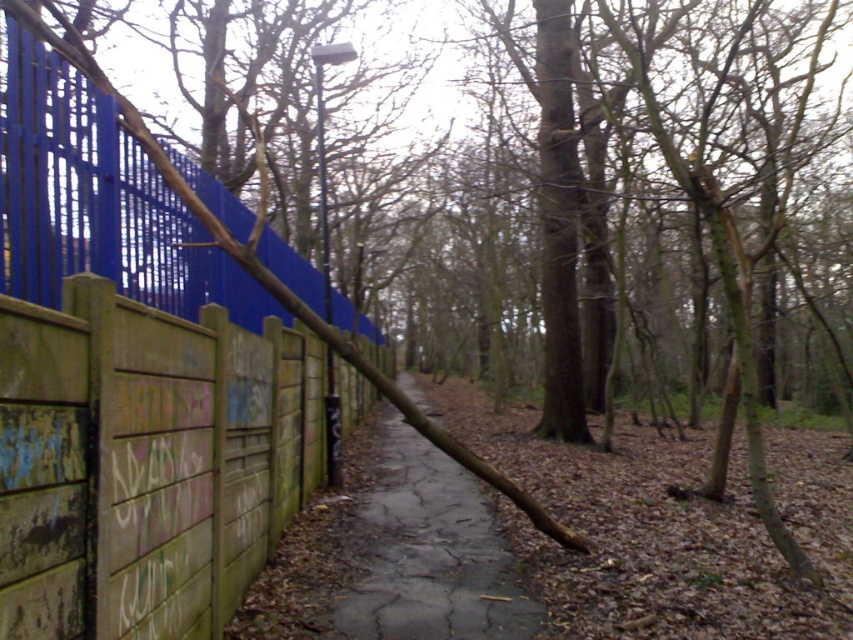
You are a delivery robot with a 3.5 feet wide package. You need to navigate through the path between the wooden fence with graffiti at left and the brown cracked pavement at center. Can you safely pass through this space?

The distance between the wooden fence with graffiti at left and the brown cracked pavement at center is 14.42 feet, which is more than enough for the delivery robot carrying a 3.5 feet wide package to pass safely.

You are a painter who wants to paint the wooden fence with graffiti at left and the brown cracked pavement at center. Which object is located above the other?

The wooden fence with graffiti at left is positioned over brown cracked pavement at center, so the wooden fence with graffiti at left is above the brown cracked pavement at center.

You are a painter who wants to cover all visible surfaces of the wooden fence with graffiti at left and the brown cracked pavement at center. Which object requires more area to be painted?

The brown cracked pavement at center requires more area to be painted because it occupies more space than the wooden fence with graffiti at left.